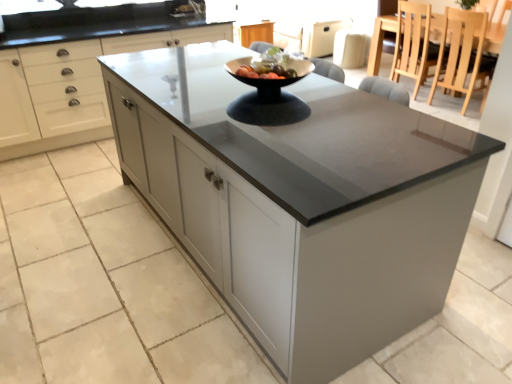
Question: Is wooden dining table at upper right inside light brown wooden chair at upper right, the first chair viewed from the back?

Choices:
 (A) no
 (B) yes

Answer: (A)

Question: Does light brown wooden chair at upper right, arranged as the second chair when viewed from the front, appear on the right side of wooden dining table at upper right?

Choices:
 (A) no
 (B) yes

Answer: (A)

Question: Is light brown wooden chair at upper right, the first chair viewed from the back, positioned with its back to wooden dining table at upper right?

Choices:
 (A) no
 (B) yes

Answer: (B)

Question: Is light brown wooden chair at upper right, arranged as the second chair when viewed from the front, taller than wooden dining table at upper right?

Choices:
 (A) no
 (B) yes

Answer: (B)

Question: Can you confirm if light brown wooden chair at upper right, the first chair viewed from the back, is smaller than wooden dining table at upper right?

Choices:
 (A) no
 (B) yes

Answer: (B)

Question: Is light brown wooden chair at upper right, the first chair viewed from the back, completely or partially outside of wooden dining table at upper right?

Choices:
 (A) yes
 (B) no

Answer: (B)

Question: Is wooden dining table at upper right bigger than light brown wooden chair at upper right, arranged as the second chair when viewed from the front?

Choices:
 (A) no
 (B) yes

Answer: (B)

Question: Does wooden dining table at upper right have a lesser height compared to light brown wooden chair at upper right, arranged as the second chair when viewed from the front?

Choices:
 (A) yes
 (B) no

Answer: (A)

Question: Is wooden dining table at upper right positioned in front of light brown wooden chair at upper right, the first chair viewed from the back?

Choices:
 (A) yes
 (B) no

Answer: (A)

Question: Is light brown wooden chair at upper right, arranged as the second chair when viewed from the front, at the back of wooden dining table at upper right?

Choices:
 (A) no
 (B) yes

Answer: (A)

Question: Considering the relative positions of wooden dining table at upper right and light brown wooden chair at upper right, the first chair viewed from the back, in the image provided, is wooden dining table at upper right to the right of light brown wooden chair at upper right, the first chair viewed from the back, from the viewer's perspective?

Choices:
 (A) yes
 (B) no

Answer: (A)

Question: Can you confirm if wooden dining table at upper right is thinner than light brown wooden chair at upper right, the first chair viewed from the back?

Choices:
 (A) yes
 (B) no

Answer: (B)

Question: Is light wood chair at upper right, the 1th chair in the front-to-back sequence, located within matte white cabinets at center?

Choices:
 (A) no
 (B) yes

Answer: (A)